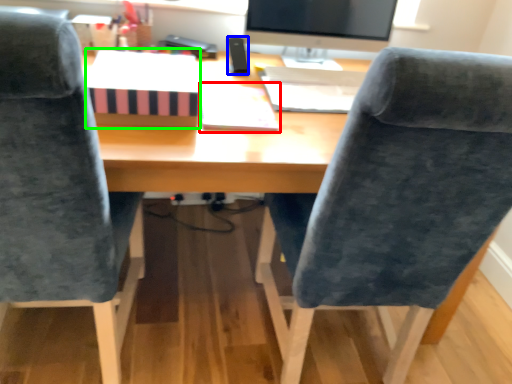
Question: Which object is the farthest from notebook (highlighted by a red box)? Choose among these: stationery (highlighted by a blue box) or book (highlighted by a green box).

Choices:
 (A) stationery
 (B) book

Answer: (A)